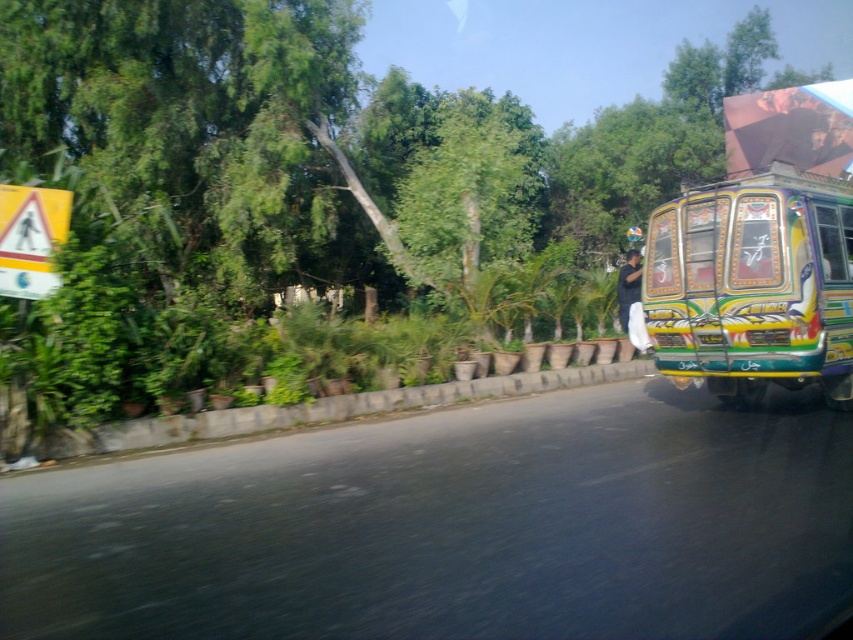
You are a delivery person who needs to load a tall package onto the back of a truck. The truck is parked next to the decorative painted bus at right and the black fabric man at right. Based on the scene, can you determine if the package will fit vertically between them?

The decorative painted bus at right is taller than the black fabric man at right. Since the package needs to fit vertically between them, its height must be less than the shorter of the two. However, since the bus is taller, the limiting factor would be the height of the black fabric man at right. If the package is shorter than the man, it should fit.

You are a pedestrian standing on the road. You see the decorative painted bus at right and the black fabric man at right. How far apart are they?

The decorative painted bus at right and the black fabric man at right are 5.02 meters apart.